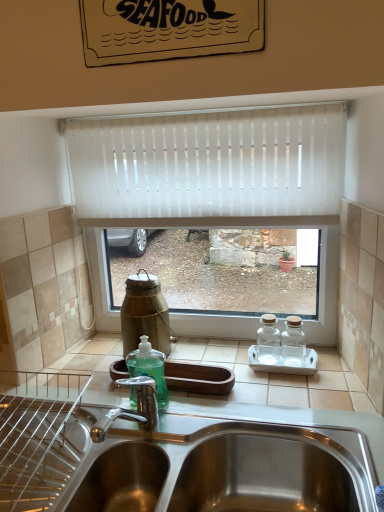
Question: Is green glass bottle at center not near stainless steel sink at lower center?

Choices:
 (A) no
 (B) yes

Answer: (A)

Question: Considering the relative positions of green glass bottle at center and stainless steel sink at lower center in the image provided, is green glass bottle at center to the right of stainless steel sink at lower center from the viewer's perspective?

Choices:
 (A) yes
 (B) no

Answer: (B)

Question: From the image's perspective, is green glass bottle at center on stainless steel sink at lower center?

Choices:
 (A) yes
 (B) no

Answer: (A)

Question: From a real-world perspective, is green glass bottle at center on top of stainless steel sink at lower center?

Choices:
 (A) no
 (B) yes

Answer: (B)

Question: Considering the relative sizes of green glass bottle at center and stainless steel sink at lower center in the image provided, is green glass bottle at center smaller than stainless steel sink at lower center?

Choices:
 (A) yes
 (B) no

Answer: (A)

Question: Based on their sizes in the image, would you say stainless steel sink at lower center is bigger or smaller than green glass bottle at center?

Choices:
 (A) big
 (B) small

Answer: (A)

Question: Is stainless steel sink at lower center in front of or behind green glass bottle at center in the image?

Choices:
 (A) behind
 (B) front

Answer: (B)

Question: From a real-world perspective, is stainless steel sink at lower center positioned above or below green glass bottle at center?

Choices:
 (A) above
 (B) below

Answer: (B)

Question: Is stainless steel sink at lower center wider or thinner than green glass bottle at center?

Choices:
 (A) wide
 (B) thin

Answer: (A)

Question: Do you think white vertical blinds at center is within stainless steel sink at lower center, or outside of it?

Choices:
 (A) outside
 (B) inside

Answer: (A)

Question: Considering the positions of white vertical blinds at center and stainless steel sink at lower center in the image, is white vertical blinds at center bigger or smaller than stainless steel sink at lower center?

Choices:
 (A) small
 (B) big

Answer: (A)

Question: Does point (135, 197) appear closer or farther from the camera than point (244, 459)?

Choices:
 (A) closer
 (B) farther

Answer: (B)

Question: From a real-world perspective, is white vertical blinds at center positioned above or below stainless steel sink at lower center?

Choices:
 (A) below
 (B) above

Answer: (B)

Question: Does point click(145, 309) appear closer or farther from the camera than point click(31, 453)?

Choices:
 (A) closer
 (B) farther

Answer: (B)

Question: Looking at the image, does green glass bottle at center seem bigger or smaller compared to stainless steel sink at lower center?

Choices:
 (A) big
 (B) small

Answer: (B)